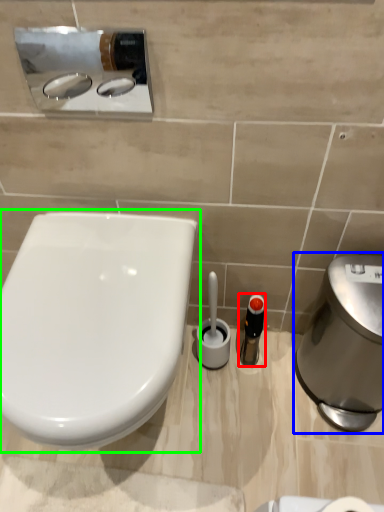
Question: Which object is the closest to the toiletry (highlighted by a red box)? Choose among these: hand dryer (highlighted by a blue box) or toilet (highlighted by a green box).

Choices:
 (A) hand dryer
 (B) toilet

Answer: (A)